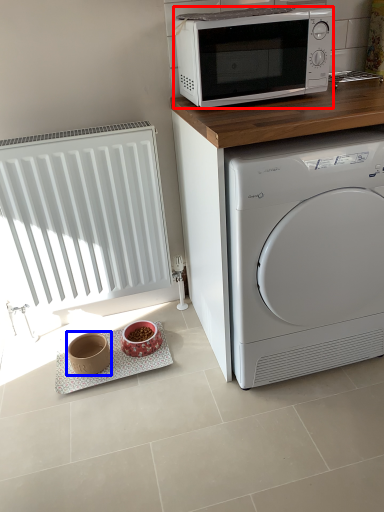
Question: Which object appears farthest to the camera in this image, microwave oven (highlighted by a red box) or appliance (highlighted by a blue box)?

Choices:
 (A) microwave oven
 (B) appliance

Answer: (B)